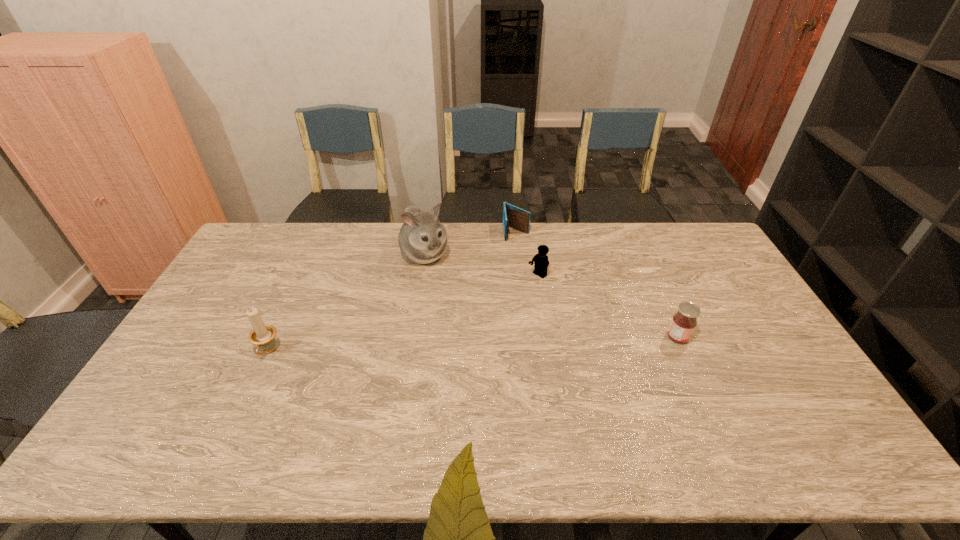
The image size is (960, 540). What are the coordinates of `vacant space at the far edge of the desktop` in the screenshot? It's located at [x=515, y=238].

You are a GUI agent. You are given a task and a screenshot of the screen. Output one action in this format:
    pyautogui.click(x=<x>, y=<y>)
    Task: Click on the free spot at the near edge of the desktop
    
    Given the screenshot: What is the action you would take?
    pyautogui.click(x=312, y=421)

In the image, there is a desktop. What are the coordinates of `free space at the left edge` in the screenshot? It's located at (217, 308).

Find the location of a particular element. Image resolution: width=960 pixels, height=540 pixels. free space at the right edge of the desktop is located at coordinates (779, 382).

You are a GUI agent. You are given a task and a screenshot of the screen. Output one action in this format:
    pyautogui.click(x=<x>, y=<y>)
    Task: Click on the vacant space at the far left corner
    This screenshot has width=960, height=540.
    Given the screenshot: What is the action you would take?
    pyautogui.click(x=287, y=247)

Find the location of a particular element. This screenshot has width=960, height=540. blank area at the far right corner is located at coordinates (687, 255).

Identify the location of empty location between the wallet and the fourth object from right to left. (470, 244).

At what (x,y) coordinates should I click in order to perform the action: click on empty space between the Lego and the candle_holder. Please return your answer as a coordinate pair (x, y). This screenshot has height=540, width=960. Looking at the image, I should click on (403, 314).

Where is `vacant region between the rightmost object and the Lego`? This screenshot has height=540, width=960. vacant region between the rightmost object and the Lego is located at coordinates (608, 307).

In order to click on free space between the Lego and the jam in this screenshot , I will do `click(608, 307)`.